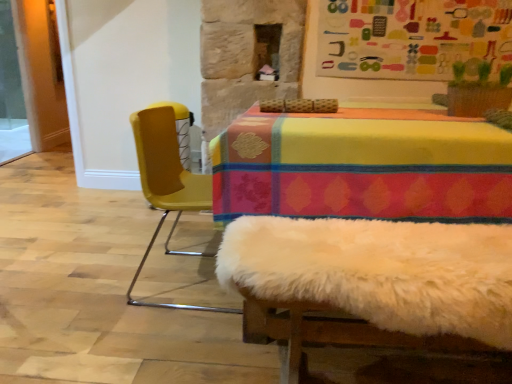
Question: Considering the positions of transparent glass screen door at left and yellow plastic chair at left in the image, is transparent glass screen door at left taller or shorter than yellow plastic chair at left?

Choices:
 (A) short
 (B) tall

Answer: (B)

Question: Is transparent glass screen door at left inside the boundaries of yellow plastic chair at left, or outside?

Choices:
 (A) outside
 (B) inside

Answer: (A)

Question: Which of these objects is positioned closest to the transparent glass screen door at left?

Choices:
 (A) yellow plastic chair at left
 (B) multicolored fabric bulletin board at upper center

Answer: (A)

Question: Estimate the real-world distances between objects in this image. Which object is farther from the yellow plastic chair at left?

Choices:
 (A) multicolored fabric bulletin board at upper center
 (B) transparent glass screen door at left

Answer: (B)